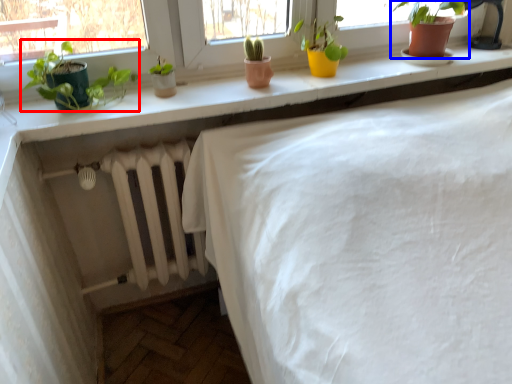
Question: Which object is further to the camera taking this photo, houseplant (highlighted by a red box) or houseplant (highlighted by a blue box)?

Choices:
 (A) houseplant
 (B) houseplant

Answer: (B)